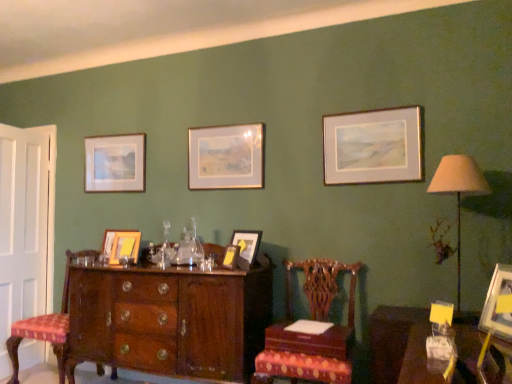
Question: Does wooden table at lower right turn towards beige fabric lampshade at right?

Choices:
 (A) no
 (B) yes

Answer: (A)

Question: From the image's perspective, would you say wooden table at lower right is shown under beige fabric lampshade at right?

Choices:
 (A) no
 (B) yes

Answer: (B)

Question: Is wooden table at lower right bigger than beige fabric lampshade at right?

Choices:
 (A) yes
 (B) no

Answer: (A)

Question: Is wooden table at lower right far from beige fabric lampshade at right?

Choices:
 (A) no
 (B) yes

Answer: (A)

Question: Can you confirm if wooden table at lower right is shorter than beige fabric lampshade at right?

Choices:
 (A) no
 (B) yes

Answer: (B)

Question: From a real-world perspective, relative to matte gold picture frame at center, the 2th picture frame from the front, is gold-framed painting at center, the 3th picture frame when ordered from left to right, vertically above or below?

Choices:
 (A) below
 (B) above

Answer: (B)

Question: Visually, is gold-framed painting at center, the 3th picture frame when ordered from left to right, positioned to the left or to the right of matte gold picture frame at center, positioned as the 4th picture frame in right-to-left order?

Choices:
 (A) right
 (B) left

Answer: (B)

Question: Relative to matte gold picture frame at center, which is counted as the 4th picture frame, starting from the left, is gold-framed painting at center, placed as the 5th picture frame when sorted from front to back, in front or behind?

Choices:
 (A) front
 (B) behind

Answer: (B)

Question: Do you think gold-framed painting at center, placed as the third picture frame when sorted from back to front, is within matte gold picture frame at center, which is counted as the 4th picture frame, starting from the left, or outside of it?

Choices:
 (A) inside
 (B) outside

Answer: (B)

Question: Considering the positions of mahogany wood chair at center, which is counted as the 1th chair, starting from the front, and wooden chair with upholstered seat at left, arranged as the 1th chair when viewed from the left, in the image, is mahogany wood chair at center, which is counted as the 1th chair, starting from the front, taller or shorter than wooden chair with upholstered seat at left, arranged as the 1th chair when viewed from the left,?

Choices:
 (A) tall
 (B) short

Answer: (B)

Question: From a real-world perspective, relative to wooden chair with upholstered seat at left, which ranks as the 2th chair in front-to-back order, is mahogany wood chair at center, which is counted as the 1th chair, starting from the front, vertically above or below?

Choices:
 (A) above
 (B) below

Answer: (A)

Question: Based on their positions, is mahogany wood chair at center, the second chair in the left-to-right sequence, located to the left or right of wooden chair with upholstered seat at left, which ranks as the 2th chair in front-to-back order?

Choices:
 (A) left
 (B) right

Answer: (B)

Question: Choose the correct answer: Is mahogany wood chair at center, the second chair in the left-to-right sequence, inside wooden chair with upholstered seat at left, the 1th chair viewed from the back, or outside it?

Choices:
 (A) outside
 (B) inside

Answer: (A)

Question: Is matte gold picture frame at center, which is counted as the 4th picture frame, starting from the left, taller or shorter than matte gold picture frame at center, the fourth picture frame viewed from the back?

Choices:
 (A) short
 (B) tall

Answer: (A)

Question: Does point (239, 251) appear closer or farther from the camera than point (243, 246)?

Choices:
 (A) farther
 (B) closer

Answer: (B)